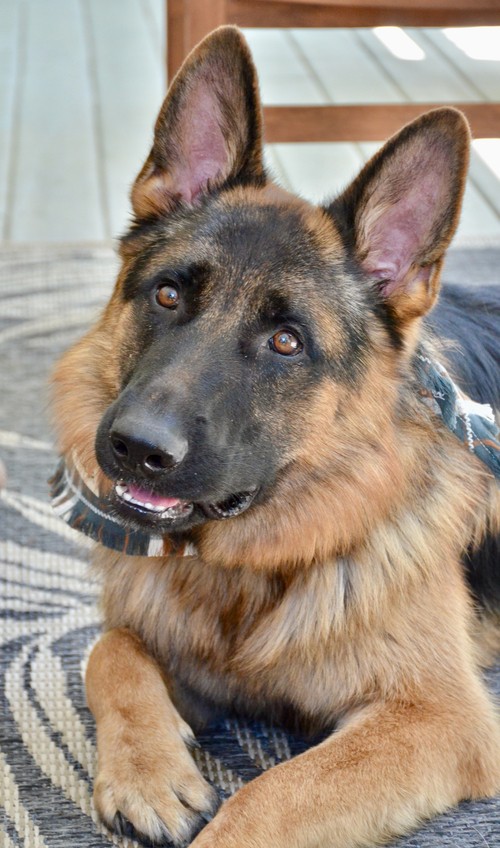
The image size is (500, 848). In order to click on back of wooden chair in this screenshot , I will do `click(367, 123)`.